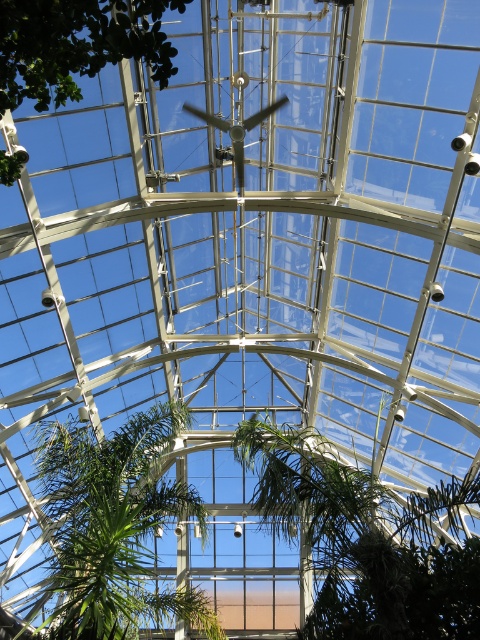
Question: Which point is farther from the camera taking this photo?

Choices:
 (A) (82, 4)
 (B) (144, 584)

Answer: (B)

Question: Considering the relative positions of green leafy tree at center and green leafy tree at upper center in the image provided, where is green leafy tree at center located with respect to green leafy tree at upper center?

Choices:
 (A) below
 (B) above

Answer: (A)

Question: Which point is farther to the camera?

Choices:
 (A) green leafy plant at center
 (B) green leafy tree at center

Answer: (B)

Question: Which point is farther to the camera?

Choices:
 (A) (128, 604)
 (B) (50, 68)

Answer: (A)

Question: Can you confirm if green leafy tree at center is wider than green leafy tree at upper center?

Choices:
 (A) no
 (B) yes

Answer: (B)

Question: Does green leafy plant at center have a greater width compared to green leafy tree at upper center?

Choices:
 (A) no
 (B) yes

Answer: (B)